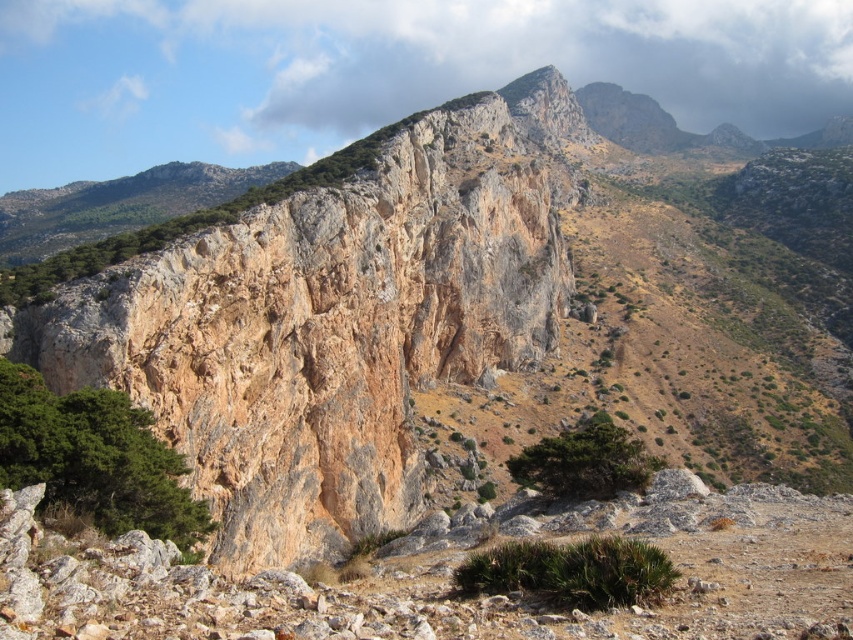
Question: Can you confirm if green leafy tree at lower left is bigger than green rough textured tree at center?

Choices:
 (A) no
 (B) yes

Answer: (A)

Question: Which of the following is the farthest from the observer?

Choices:
 (A) (523, 451)
 (B) (201, 528)

Answer: (A)

Question: Does green leafy tree at lower left appear on the left side of green rough textured tree at center?

Choices:
 (A) no
 (B) yes

Answer: (B)

Question: Which point is farther to the camera?

Choices:
 (A) green rough textured tree at center
 (B) green leafy tree at lower left

Answer: (A)

Question: Can you confirm if green leafy tree at lower left is positioned below green rough textured tree at center?

Choices:
 (A) no
 (B) yes

Answer: (A)

Question: Which point is farther to the camera?

Choices:
 (A) (523, 483)
 (B) (74, 474)

Answer: (A)